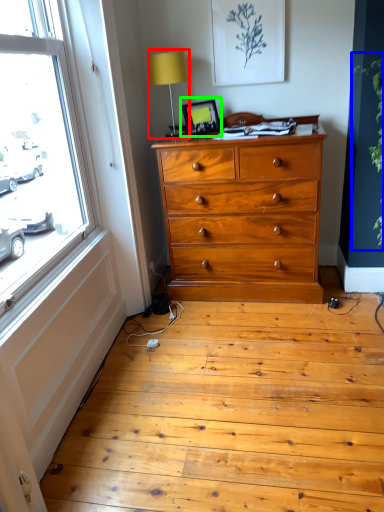
Question: Considering the real-world distances, which object is closest to table lamp (highlighted by a red box)? plant (highlighted by a blue box) or picture frame (highlighted by a green box).

Choices:
 (A) plant
 (B) picture frame

Answer: (B)